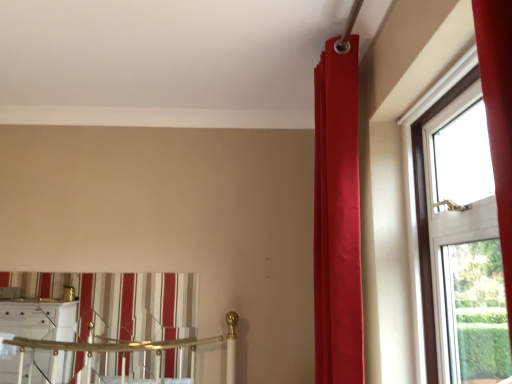
Question: Can striped fabric curtain at lower left, placed as the first curtain when sorted from back to front, be found inside satin red curtain at upper right, the first curtain from the front?

Choices:
 (A) no
 (B) yes

Answer: (A)

Question: From a real-world perspective, is satin red curtain at upper right, the first curtain from the front, beneath striped fabric curtain at lower left, placed as the 2th curtain when sorted from right to left?

Choices:
 (A) no
 (B) yes

Answer: (A)

Question: Is satin red curtain at upper right, marked as the 2th curtain in a left-to-right arrangement, outside of striped fabric curtain at lower left, the second curtain viewed from the front?

Choices:
 (A) yes
 (B) no

Answer: (A)

Question: Is satin red curtain at upper right, marked as the 2th curtain in a left-to-right arrangement, to the right of striped fabric curtain at lower left, placed as the 2th curtain when sorted from right to left, from the viewer's perspective?

Choices:
 (A) yes
 (B) no

Answer: (A)

Question: Could you tell me if satin red curtain at upper right, marked as the 2th curtain in a left-to-right arrangement, is turned towards striped fabric curtain at lower left, placed as the first curtain when sorted from back to front?

Choices:
 (A) yes
 (B) no

Answer: (B)

Question: Is transparent glass window at right spatially inside striped fabric curtain at lower left, the second curtain viewed from the front, or outside of it?

Choices:
 (A) outside
 (B) inside

Answer: (A)

Question: Considering the positions of transparent glass window at right and striped fabric curtain at lower left, placed as the first curtain when sorted from back to front, in the image, is transparent glass window at right taller or shorter than striped fabric curtain at lower left, placed as the first curtain when sorted from back to front,?

Choices:
 (A) short
 (B) tall

Answer: (B)

Question: Relative to striped fabric curtain at lower left, placed as the first curtain when sorted from back to front, is transparent glass window at right in front or behind?

Choices:
 (A) front
 (B) behind

Answer: (A)

Question: Considering the positions of transparent glass window at right and striped fabric curtain at lower left, placed as the first curtain when sorted from back to front, in the image, is transparent glass window at right wider or thinner than striped fabric curtain at lower left, placed as the first curtain when sorted from back to front,?

Choices:
 (A) wide
 (B) thin

Answer: (A)

Question: From the image's perspective, is transparent glass window at right located above or below satin red curtain at upper right, which ranks as the first curtain in right-to-left order?

Choices:
 (A) above
 (B) below

Answer: (B)

Question: From a real-world perspective, is transparent glass window at right above or below satin red curtain at upper right, the first curtain from the front?

Choices:
 (A) below
 (B) above

Answer: (A)

Question: Which is correct: transparent glass window at right is inside satin red curtain at upper right, marked as the 2th curtain in a left-to-right arrangement, or outside of it?

Choices:
 (A) outside
 (B) inside

Answer: (A)

Question: Considering the relative positions of transparent glass window at right and satin red curtain at upper right, which ranks as the first curtain in right-to-left order, in the image provided, is transparent glass window at right to the left or to the right of satin red curtain at upper right, which ranks as the first curtain in right-to-left order,?

Choices:
 (A) left
 (B) right

Answer: (B)

Question: Considering the positions of point (115, 279) and point (352, 54), is point (115, 279) closer or farther from the camera than point (352, 54)?

Choices:
 (A) farther
 (B) closer

Answer: (A)

Question: Choose the correct answer: Is striped fabric curtain at lower left, the second curtain viewed from the front, inside satin red curtain at upper right, the first curtain from the front, or outside it?

Choices:
 (A) inside
 (B) outside

Answer: (B)